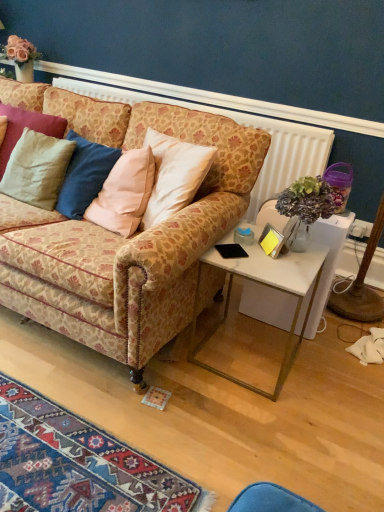
The image size is (384, 512). Find the location of `vacant area that lies between white marble side table at right and white marble desk at right`. vacant area that lies between white marble side table at right and white marble desk at right is located at coordinates (272, 343).